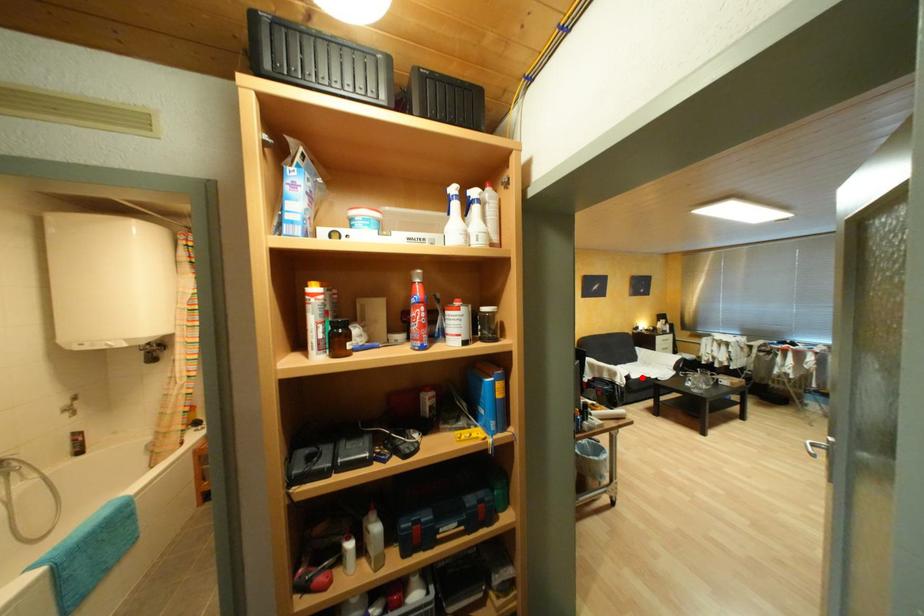
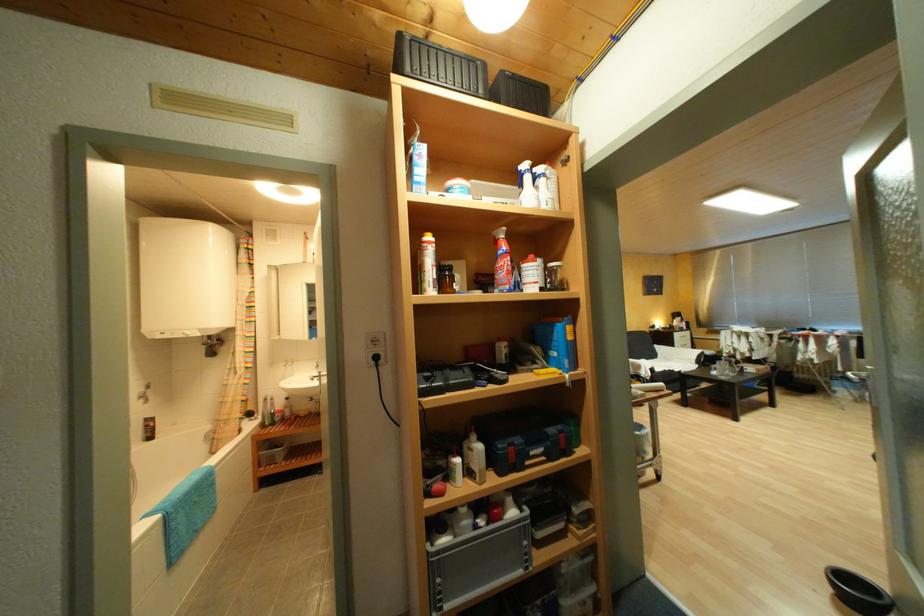
In the second image, find the point that corresponds to the highlighted location in the first image.

(666, 371)